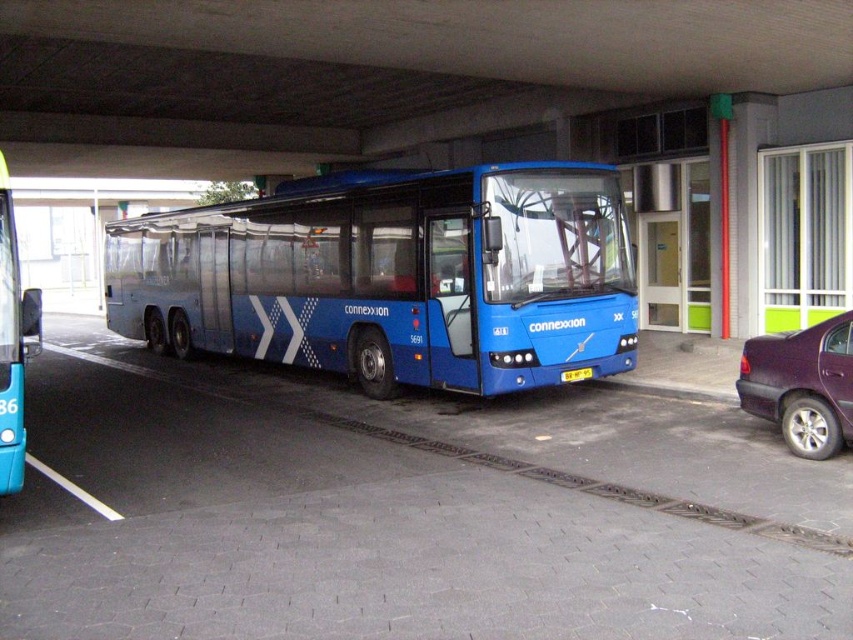
You are a delivery person needing to park your van between the metallic purple sedan at right and the blue metallic bus at left. Given that your van is 6 meters long, can you fit it in the space between them?

The metallic purple sedan at right is smaller than the blue metallic bus at left. However, the exact distance between them isn

Looking at this image, you are a driver approaching the blue Connexxion bus and need to park your metallic purple sedan at right. The parking spot has a yellow plastic license plate at center as a marker. Can you safely park your car in this spot without blocking the license plate?

The metallic purple sedan at right is closer to the viewer than the yellow plastic license plate at center, so parking the sedan in the spot would block the license plate. Choose another parking spot.

You are standing in front of the blue metallic bus at left and want to reach the yellow plastic license plate at center. Which direction should you move to get closer to the license plate?

Since the blue metallic bus at left is closer to you than the yellow plastic license plate at center, you should move forward towards the license plate to get closer to it.